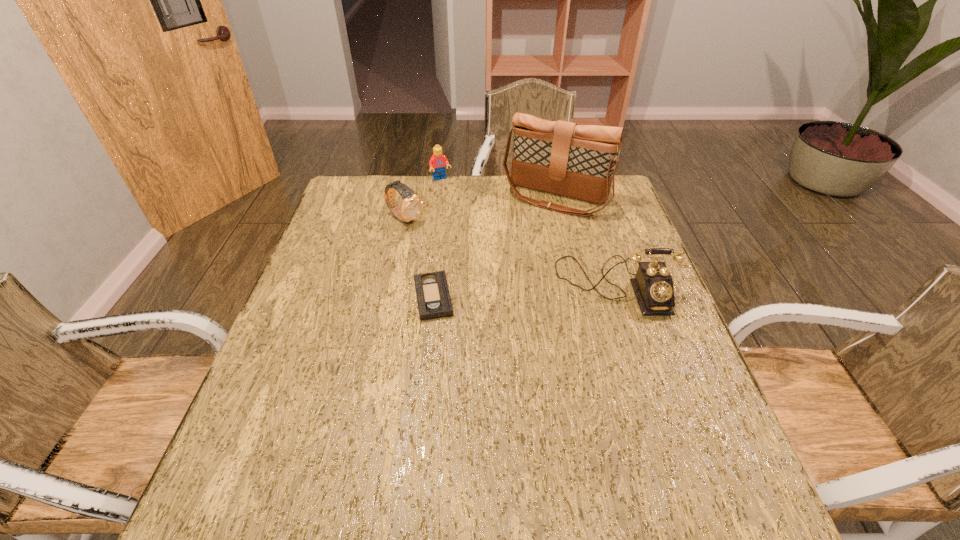
Where is `free space located 0.270m on the face of the Lego`? The width and height of the screenshot is (960, 540). free space located 0.270m on the face of the Lego is located at coordinates (472, 227).

Image resolution: width=960 pixels, height=540 pixels. Find the location of `free location located on the face of the Lego`. free location located on the face of the Lego is located at coordinates pyautogui.click(x=476, y=233).

The image size is (960, 540). I want to click on free space located 0.340m on the face of the Lego, so click(481, 241).

You are a GUI agent. You are given a task and a screenshot of the screen. Output one action in this format:
    pyautogui.click(x=<x>, y=<y>)
    Task: Click on the vacant area located on the front-facing side of the tallest object
    This screenshot has height=540, width=960.
    Given the screenshot: What is the action you would take?
    pyautogui.click(x=520, y=247)

You are a GUI agent. You are given a task and a screenshot of the screen. Output one action in this format:
    pyautogui.click(x=<x>, y=<y>)
    Task: Click on the free spot located on the front-facing side of the tallest object
    This screenshot has width=960, height=540.
    Given the screenshot: What is the action you would take?
    pyautogui.click(x=515, y=257)

Find the location of a particular element. free space located on the front-facing side of the tallest object is located at coordinates (510, 266).

Locate an element on the screen. The height and width of the screenshot is (540, 960). watch that is positioned at the far edge is located at coordinates (412, 205).

Identify the location of Lego that is at the far edge. The width and height of the screenshot is (960, 540). (438, 161).

The image size is (960, 540). Identify the location of shoulder bag that is positioned at the far edge. (578, 161).

Where is `telephone at the right edge`? This screenshot has height=540, width=960. telephone at the right edge is located at coordinates (653, 285).